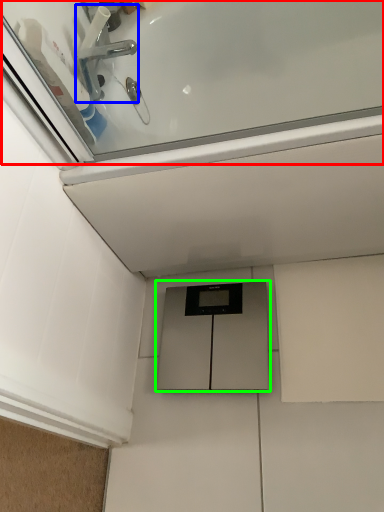
Question: Estimate the real-world distances between objects in this image. Which object is closer to bath (highlighted by a red box), tap (highlighted by a blue box) or cabinetry (highlighted by a green box)?

Choices:
 (A) tap
 (B) cabinetry

Answer: (A)